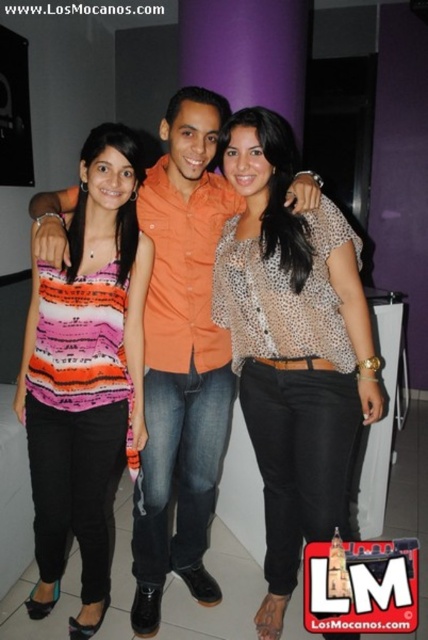
Does leopard print blouse at center come in front of orange cotton shirt at center?

Yes, it is in front of orange cotton shirt at center.

Based on the photo, who is more forward, (x=272, y=618) or (x=154, y=612)?

Positioned in front is point (x=272, y=618).

This screenshot has height=640, width=428. I want to click on leopard print blouse at center, so click(x=293, y=346).

Find the location of a particular element. leopard print blouse at center is located at coordinates (293, 346).

Can you confirm if striped fabric top at center is positioned above orange cotton shirt at center?

Actually, striped fabric top at center is below orange cotton shirt at center.

Does point (67, 356) come closer to viewer compared to point (195, 420)?

That is True.

Between point (130, 456) and point (220, 99), which one is positioned behind?

The point (220, 99) is more distant.

Identify the location of striped fabric top at center. (86, 374).

Which of these two, leopard print blouse at center or striped fabric top at center, stands shorter?

striped fabric top at center is shorter.

Is leopard print blouse at center bigger than striped fabric top at center?

Actually, leopard print blouse at center might be smaller than striped fabric top at center.

This screenshot has height=640, width=428. Describe the element at coordinates (293, 346) in the screenshot. I see `leopard print blouse at center` at that location.

Locate an element on the screen. The height and width of the screenshot is (640, 428). leopard print blouse at center is located at coordinates (293, 346).